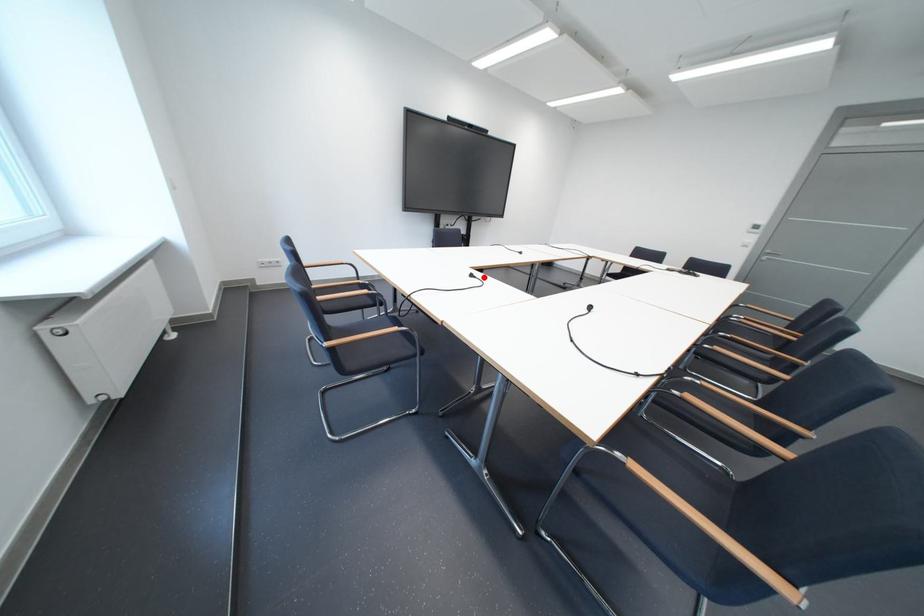
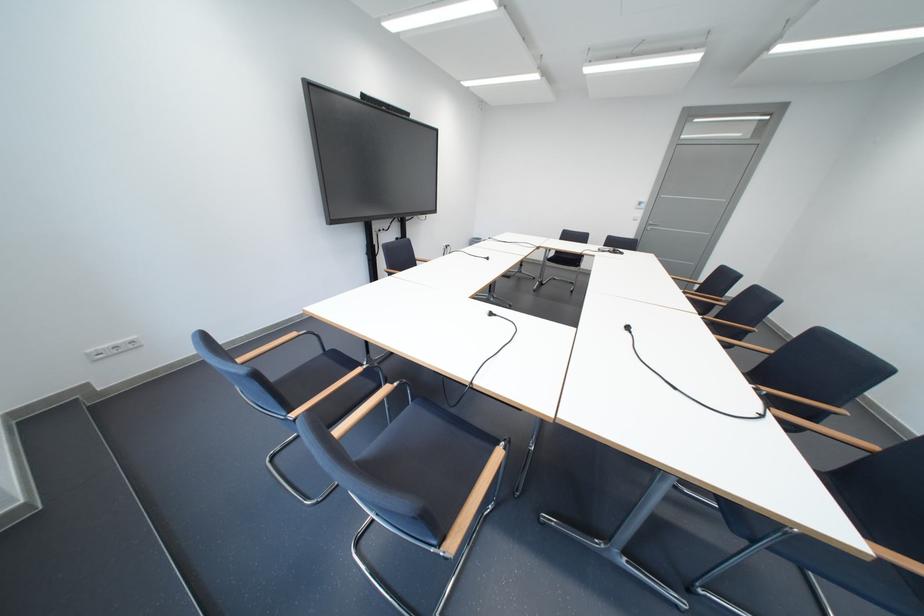
In the second image, find the point that corresponds to the highlighted location in the first image.

(503, 315)